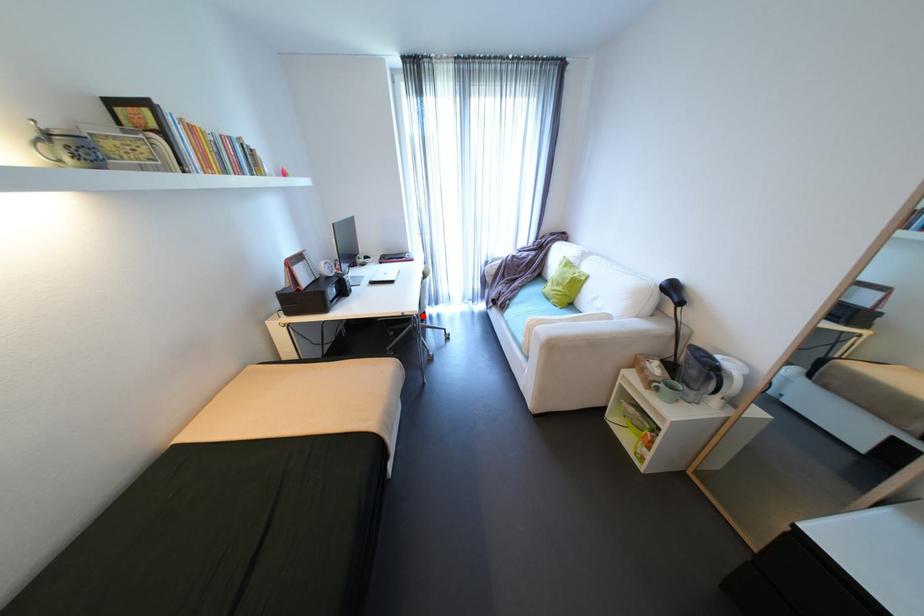
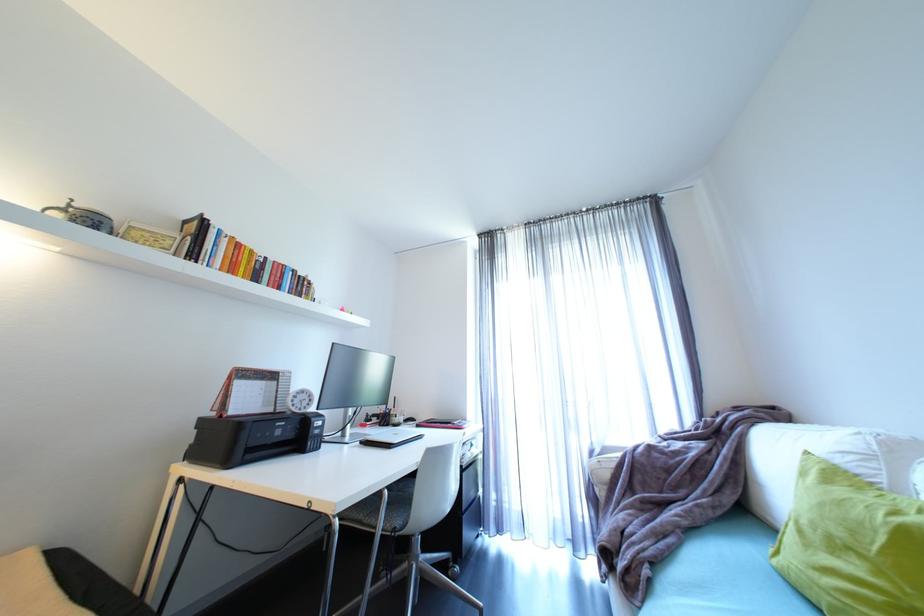
Locate, in the second image, the point that corresponds to the highlighted location in the first image.

(344, 522)